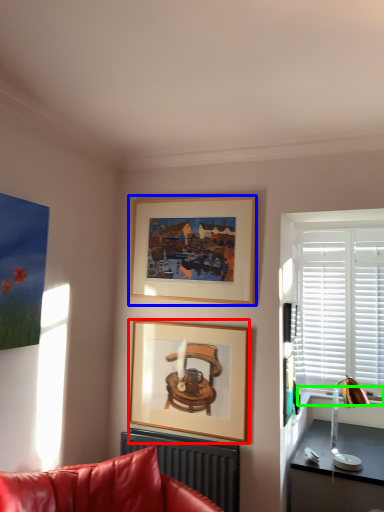
Question: Which object is positioned closest to picture frame (highlighted by a red box)? Select from picture frame (highlighted by a blue box) and window sill (highlighted by a green box).

Choices:
 (A) picture frame
 (B) window sill

Answer: (A)